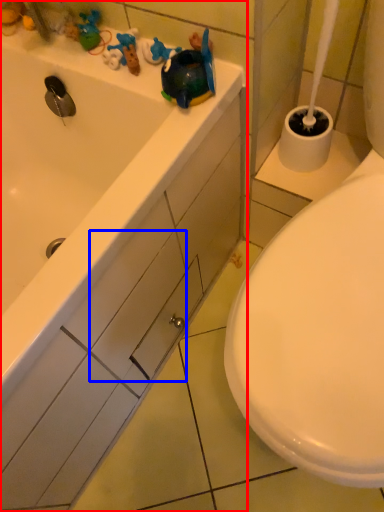
Question: Which object is further to the camera taking this photo, bathtub (highlighted by a red box) or drawer (highlighted by a blue box)?

Choices:
 (A) bathtub
 (B) drawer

Answer: (B)